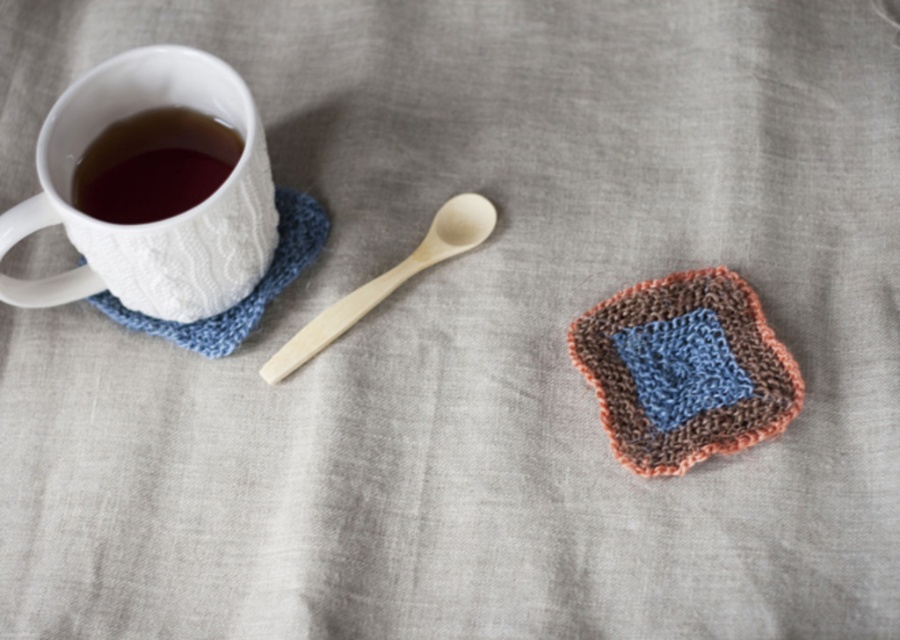
You have a small plate that can only fit items wider than the wooden spoon at center. Can the white textured mug at upper left fit on the plate?

The white textured mug at upper left is wider than the wooden spoon at center, so it can fit on the plate if the plate can accommodate its width.

You are a photographer trying to capture a closeup shot of the white textured mug at upper left. Your camera is positioned at a standard height. Can you get a clear closeup without moving the camera or the mug?

The white textured mug at upper left and camera are 1.18 meters apart from each other. Since most cameras require a minimum distance of about 0.5 meters to focus clearly, the distance of 1.18 meters is sufficient for a clear closeup without needing to move either the camera or the mug.